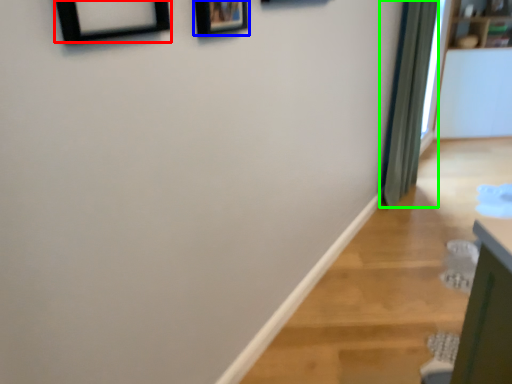
Question: Which object is the farthest from picture frame (highlighted by a red box)? Choose among these: picture frame (highlighted by a blue box) or curtain (highlighted by a green box).

Choices:
 (A) picture frame
 (B) curtain

Answer: (B)